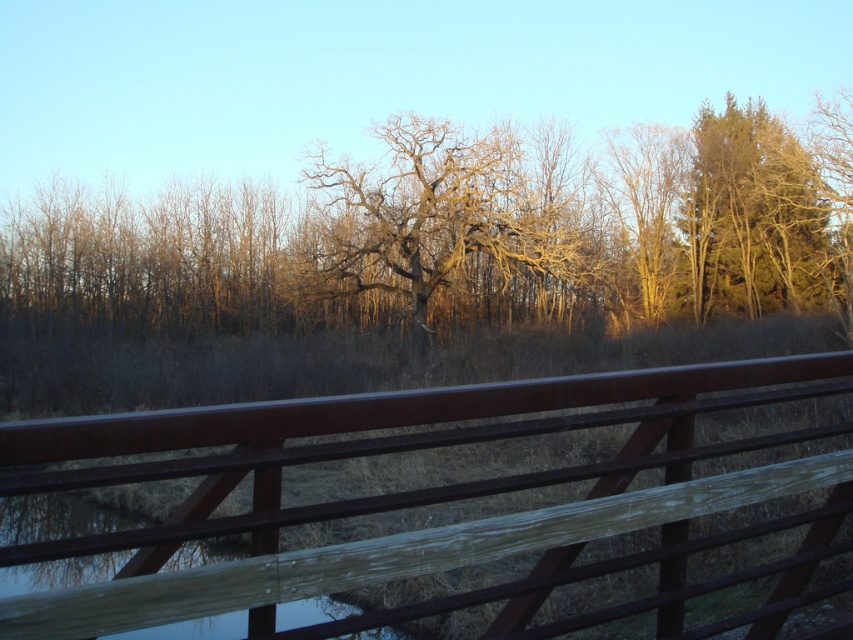
You are standing at the wooden bridge and want to take a photo. There are two points in the scene marked as point 1 at coordinates (196, 410) and point 2 at coordinates (456, 195). Which point will appear larger in your photo?

Point 1 at coordinates (196, 410) will appear larger in the photo because it is closer to the camera than point 2 at coordinates (456, 195).

You are an artist sketching the scene and want to ensure the rustic wood fence at center and the bare wood tree at center are proportionally accurate. Which object should you draw narrower in your sketch?

The rustic wood fence at center should be drawn narrower since it has a lesser width compared to the bare wood tree at center.